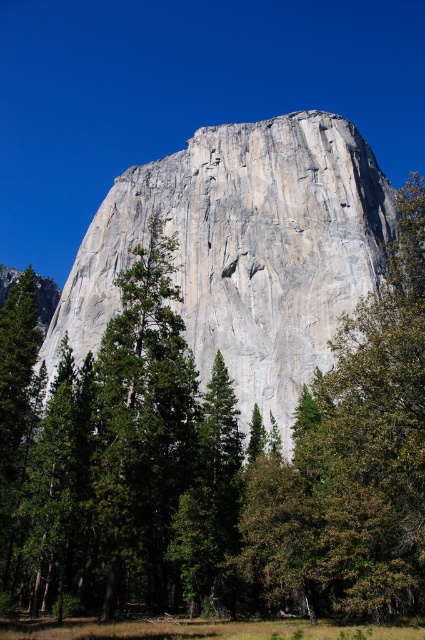
Question: Among these points, which one is farthest from the camera?

Choices:
 (A) (241, 556)
 (B) (351, 240)

Answer: (B)

Question: Is gray/rough rock at center below green leafy tree at center?

Choices:
 (A) no
 (B) yes

Answer: (A)

Question: Does gray/rough rock at center come behind green leafy tree at center?

Choices:
 (A) yes
 (B) no

Answer: (A)

Question: Does gray/rough rock at center have a lesser width compared to green leafy tree at center?

Choices:
 (A) no
 (B) yes

Answer: (A)

Question: Which point is farther from the camera taking this photo?

Choices:
 (A) (311, 524)
 (B) (354, 244)

Answer: (B)